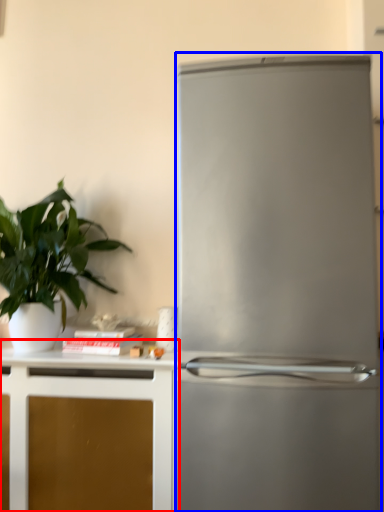
Question: Among these objects, which one is nearest to the camera, cabinetry (highlighted by a red box) or refrigerator (highlighted by a blue box)?

Choices:
 (A) cabinetry
 (B) refrigerator

Answer: (B)